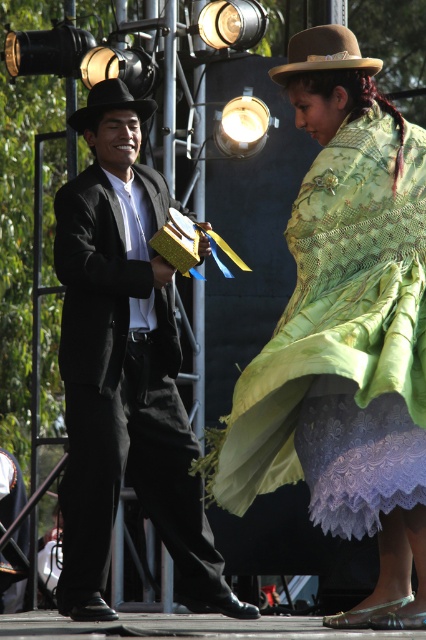
Question: Is matte black suit at center below black felt cowboy hat at left?

Choices:
 (A) yes
 (B) no

Answer: (A)

Question: Which point is closer to the camera?

Choices:
 (A) (345, 38)
 (B) (83, 516)
 (C) (106, 104)
 (D) (264, 429)

Answer: (D)

Question: Does brown felt hat at upper center appear under black felt cowboy hat at left?

Choices:
 (A) yes
 (B) no

Answer: (B)

Question: Based on their relative distances, which object is nearer to the matte black suit at center?

Choices:
 (A) green embroidered shawl at center
 (B) brown felt hat at upper center

Answer: (A)

Question: Is matte black suit at center above brown felt hat at upper center?

Choices:
 (A) yes
 (B) no

Answer: (B)

Question: Which of the following is the closest to the observer?

Choices:
 (A) black felt cowboy hat at left
 (B) green embroidered shawl at center
 (C) matte black suit at center
 (D) brown felt hat at upper center

Answer: (B)